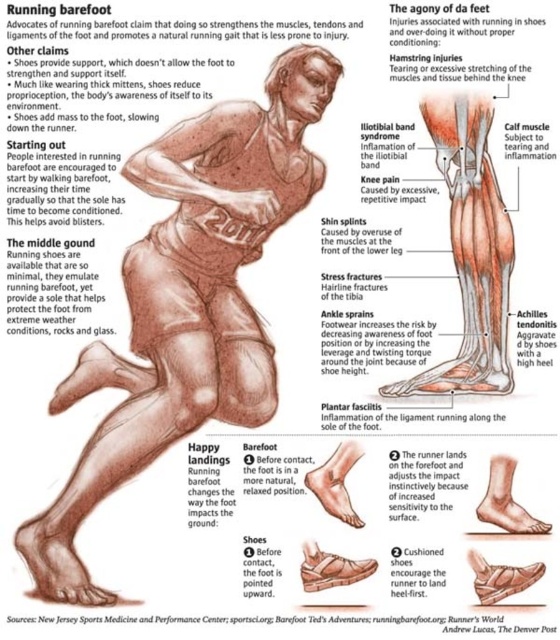
Question: Which point is farther to the camera?

Choices:
 (A) (519, 577)
 (B) (64, 596)
 (C) (194, 262)
 (D) (334, 557)

Answer: (C)

Question: Which point is closer to the camera?

Choices:
 (A) (318, 560)
 (B) (478, 589)
 (C) (549, 525)
 (D) (197, 136)

Answer: (D)

Question: Can you confirm if matte brown arm at upper center is positioned to the right of brown textured foot at lower left?

Choices:
 (A) no
 (B) yes

Answer: (B)

Question: Which object is the closest to the matte brown arm at upper center?

Choices:
 (A) matte brown shoe at lower center
 (B) brown textured paper at center
 (C) matte skin foot at lower center
 (D) matte skin leg at lower right

Answer: (B)

Question: Is brown textured paper at center bigger than matte brown shoe at lower center?

Choices:
 (A) no
 (B) yes

Answer: (A)

Question: Does matte brown arm at upper center have a greater width compared to matte brown shoe at lower center?

Choices:
 (A) no
 (B) yes

Answer: (B)